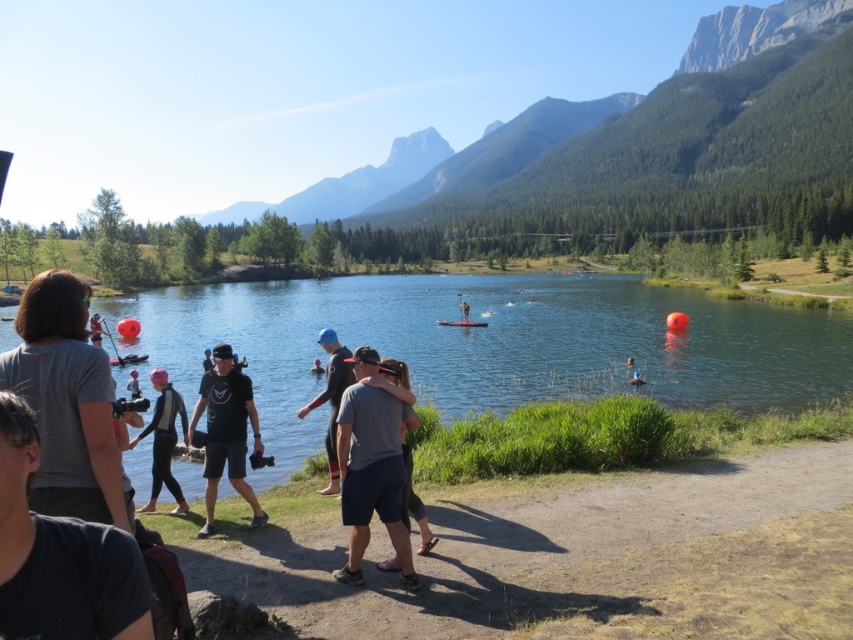
Question: Which object is the closest to the black wetsuit at center?

Choices:
 (A) matte black kayak at center
 (B) gray cotton t-shirt at center
 (C) black matte t-shirt at center

Answer: (C)

Question: Which point is farther to the camera?

Choices:
 (A) matte black camera at center
 (B) blue fabric swim cap at center
 (C) dark gray fabric shirt at center
 (D) red plastic boat at center

Answer: (D)

Question: Is gray fabric shirt at center thinner than pink fabric at center?

Choices:
 (A) no
 (B) yes

Answer: (B)

Question: Estimate the real-world distances between objects in this image. Which object is farther from the gray cotton t-shirt at left?

Choices:
 (A) matte black camera at center
 (B) red plastic boat at center
 (C) blue fabric swim cap at center

Answer: (B)

Question: Can you confirm if gray fabric shirt at center is bigger than matte black kayak at center?

Choices:
 (A) no
 (B) yes

Answer: (A)

Question: Where is dark gray t-shirt at center located in relation to matte black wetsuit at center in the image?

Choices:
 (A) above
 (B) below

Answer: (B)